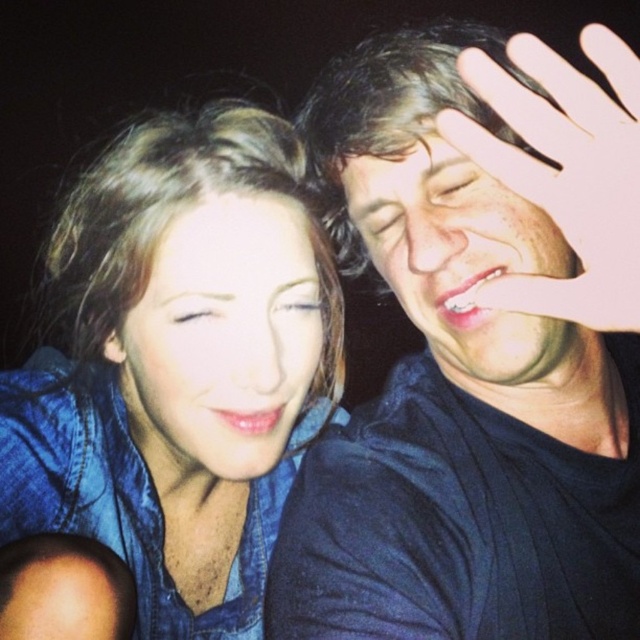
Question: Where is matte black shirt at right located in relation to blue glossy eye at center in the image?

Choices:
 (A) above
 (B) below

Answer: (A)

Question: Which point appears closest to the camera in this image?

Choices:
 (A) (35, 528)
 (B) (218, 308)
 (C) (474, 314)
 (D) (522, 68)

Answer: (D)

Question: Which of the following is the closest to the observer?

Choices:
 (A) matte black shirt at right
 (B) denim shirt at left

Answer: (A)

Question: Is matte blue denim face at center bigger than brown matte eye at center?

Choices:
 (A) yes
 (B) no

Answer: (A)

Question: Which object is farther from the camera taking this photo?

Choices:
 (A) brown matte eye at center
 (B) matte black shirt at right
 (C) smooth skin face at upper right
 (D) matte black eye at upper center

Answer: (D)

Question: Is matte blue denim face at center to the right of smooth skin face at upper right from the viewer's perspective?

Choices:
 (A) yes
 (B) no

Answer: (B)